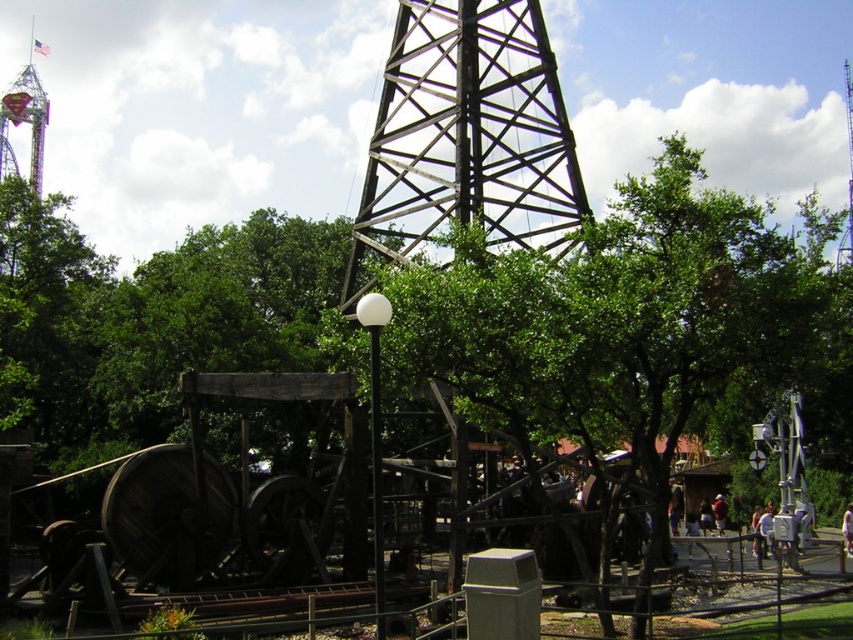
Is brushed metal tower at upper left in front of white glossy pole at center?

No, brushed metal tower at upper left is further to the viewer.

Can you confirm if brushed metal tower at upper left is bigger than white glossy pole at center?

Yes.

Locate an element on the screen. The image size is (853, 640). brushed metal tower at upper left is located at coordinates (25, 116).

I want to click on brushed metal tower at upper left, so click(x=25, y=116).